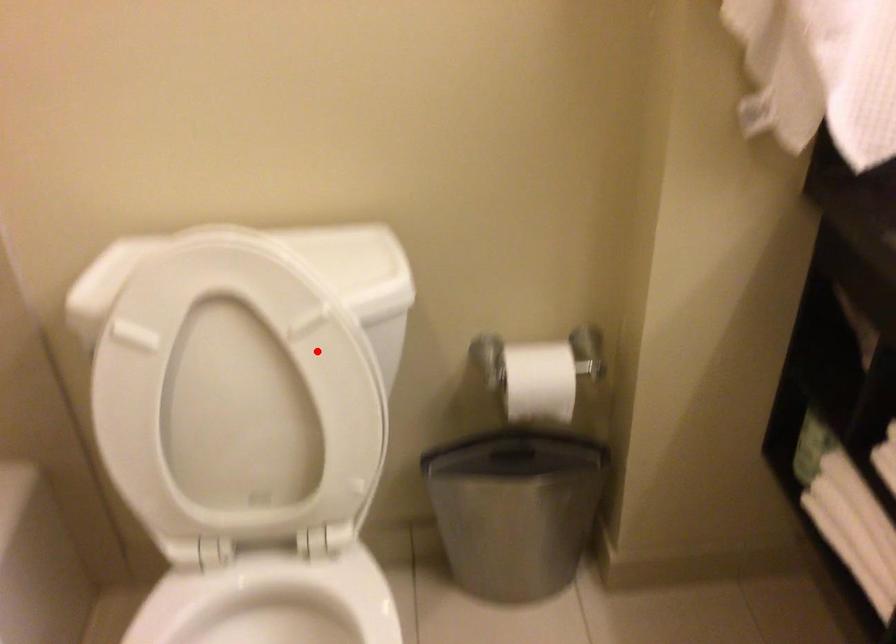
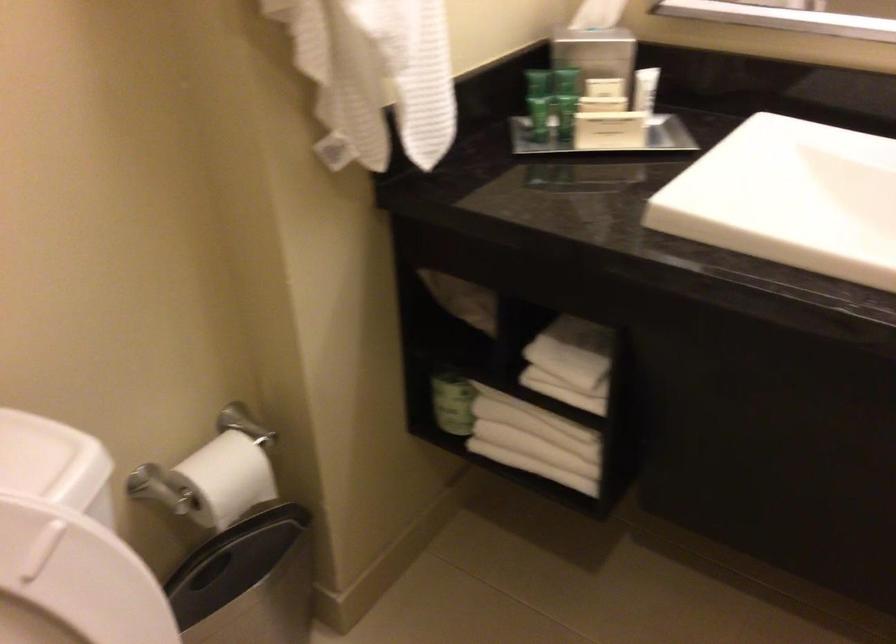
Question: I am providing you with two images of the same scene from different viewpoints. Given a red point in image1, look at the same physical point in image2. Is it:

Choices:
 (A) Closer to the viewpoint
 (B) Farther from the viewpoint

Answer: (A)